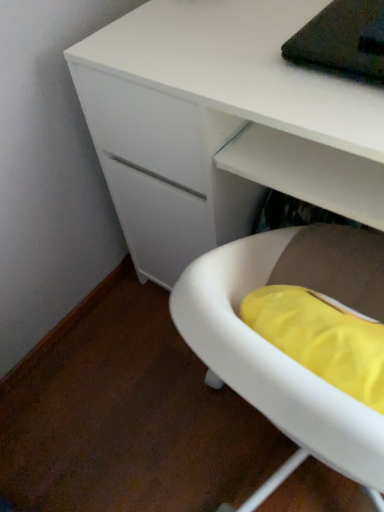
This screenshot has height=512, width=384. I want to click on empty space that is ontop of white matte desk at center (from a real-world perspective), so click(259, 44).